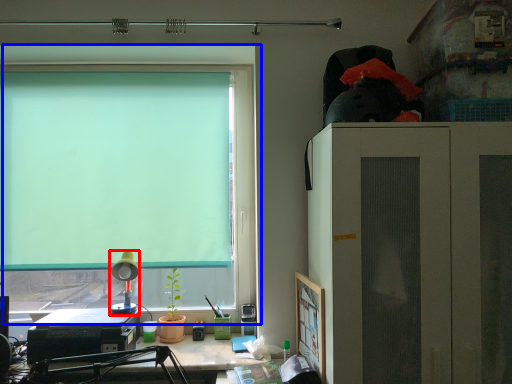
Question: Which of the following is the farthest to the observer, lamp (highlighted by a red box) or window (highlighted by a blue box)?

Choices:
 (A) lamp
 (B) window

Answer: (B)